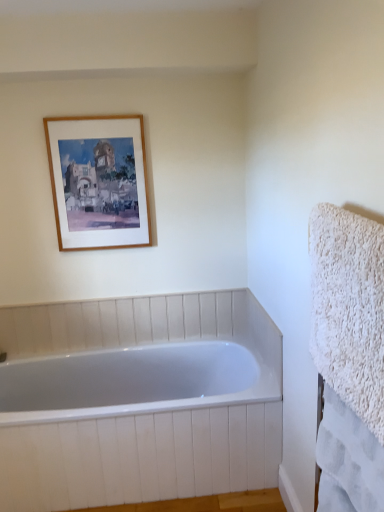
Describe the element at coordinates (142, 409) in the screenshot. I see `white glossy bathtub at center` at that location.

I want to click on white fluffy towel at right, placed as the first bath towel when sorted from top to bottom, so click(x=349, y=309).

What are the coordinates of `wooden frame at upper left` in the screenshot? It's located at (98, 181).

Considering the sizes of wooden frame at upper left and white fluffy towel at right, the second bath towel when ordered from top to bottom, in the image, is wooden frame at upper left wider or thinner than white fluffy towel at right, the second bath towel when ordered from top to bottom,?

In the image, wooden frame at upper left appears to be more narrow than white fluffy towel at right, the second bath towel when ordered from top to bottom.

Is wooden frame at upper left bigger than white fluffy towel at right, marked as the 1th bath towel in a bottom-to-top arrangement?

Yes, wooden frame at upper left is bigger than white fluffy towel at right, marked as the 1th bath towel in a bottom-to-top arrangement.

How many degrees apart are the facing directions of wooden frame at upper left and white fluffy towel at right, marked as the 1th bath towel in a bottom-to-top arrangement?

The angular difference between wooden frame at upper left and white fluffy towel at right, marked as the 1th bath towel in a bottom-to-top arrangement, is 90.6 degrees.

Does wooden frame at upper left lie in front of white fluffy towel at right, the second bath towel when ordered from top to bottom?

No, wooden frame at upper left is behind white fluffy towel at right, the second bath towel when ordered from top to bottom.

Is white fluffy towel at right, the second bath towel positioned from the bottom, to the left of white fluffy towel at right, marked as the 1th bath towel in a bottom-to-top arrangement, from the viewer's perspective?

Indeed, white fluffy towel at right, the second bath towel positioned from the bottom, is positioned on the left side of white fluffy towel at right, marked as the 1th bath towel in a bottom-to-top arrangement.

In terms of size, does white fluffy towel at right, the second bath towel positioned from the bottom, appear bigger or smaller than white fluffy towel at right, the second bath towel when ordered from top to bottom?

In the image, white fluffy towel at right, the second bath towel positioned from the bottom, appears to be larger than white fluffy towel at right, the second bath towel when ordered from top to bottom.

From the image's perspective, is white fluffy towel at right, placed as the first bath towel when sorted from top to bottom, above or below white fluffy towel at right, the second bath towel when ordered from top to bottom?

Clearly, from the image's perspective, white fluffy towel at right, placed as the first bath towel when sorted from top to bottom, is above white fluffy towel at right, the second bath towel when ordered from top to bottom.

From a real-world perspective, which is physically below, white fluffy towel at right, placed as the first bath towel when sorted from top to bottom, or white fluffy towel at right, the second bath towel when ordered from top to bottom?

white fluffy towel at right, the second bath towel when ordered from top to bottom, is physically lower.

Considering the sizes of objects white glossy bathtub at center and white fluffy towel at right, the second bath towel when ordered from top to bottom, in the image provided, who is wider, white glossy bathtub at center or white fluffy towel at right, the second bath towel when ordered from top to bottom,?

With larger width is white glossy bathtub at center.

Is white glossy bathtub at center looking in the opposite direction of white fluffy towel at right, marked as the 1th bath towel in a bottom-to-top arrangement?

That's not correct — white glossy bathtub at center is not looking away from white fluffy towel at right, marked as the 1th bath towel in a bottom-to-top arrangement.

From a real-world perspective, which object stands above the other?

white fluffy towel at right, marked as the 1th bath towel in a bottom-to-top arrangement, is physically above.

Considering the relative positions of white glossy bathtub at center and white fluffy towel at right, the second bath towel when ordered from top to bottom, in the image provided, is white glossy bathtub at center in front of white fluffy towel at right, the second bath towel when ordered from top to bottom,?

No.

Is white glossy bathtub at center at the back of wooden frame at upper left?

That's not correct — wooden frame at upper left is not looking away from white glossy bathtub at center.

Is the surface of wooden frame at upper left in direct contact with white glossy bathtub at center?

There is a gap between wooden frame at upper left and white glossy bathtub at center.

Identify the location of the 2nd bath towel in front of the wooden frame at upper left, starting your count from the anchor. [349, 309].

How different are the orientations of wooden frame at upper left and white fluffy towel at right, the second bath towel positioned from the bottom, in degrees?

There is a 90.6-degree angle between the facing directions of wooden frame at upper left and white fluffy towel at right, the second bath towel positioned from the bottom.

Consider the image. From a real-world perspective, is wooden frame at upper left positioned above or below white fluffy towel at right, placed as the first bath towel when sorted from top to bottom?

From a real-world perspective, wooden frame at upper left is physically above white fluffy towel at right, placed as the first bath towel when sorted from top to bottom.

Which is less distant, (75, 211) or (315, 338)?

The point (315, 338) is in front.

Who is bigger, white glossy bathtub at center or white fluffy towel at right, placed as the first bath towel when sorted from top to bottom?

white glossy bathtub at center.

Does point (155, 425) appear closer or farther from the camera than point (372, 356)?

Point (155, 425) is positioned farther from the camera compared to point (372, 356).

From a real-world perspective, between white glossy bathtub at center and white fluffy towel at right, placed as the first bath towel when sorted from top to bottom, who is vertically lower?

white glossy bathtub at center is physically lower.

Is white glossy bathtub at center inside or outside of white fluffy towel at right, placed as the first bath towel when sorted from top to bottom?

white glossy bathtub at center is not enclosed by white fluffy towel at right, placed as the first bath towel when sorted from top to bottom.

In terms of size, does white fluffy towel at right, placed as the first bath towel when sorted from top to bottom, appear bigger or smaller than wooden frame at upper left?

Clearly, white fluffy towel at right, placed as the first bath towel when sorted from top to bottom, is larger in size than wooden frame at upper left.

Is white fluffy towel at right, the second bath towel positioned from the bottom, oriented towards wooden frame at upper left?

No.

Is white fluffy towel at right, the second bath towel positioned from the bottom, wider than wooden frame at upper left?

Yes, white fluffy towel at right, the second bath towel positioned from the bottom, is wider than wooden frame at upper left.

Consider the image. How many degrees apart are the facing directions of white fluffy towel at right, the second bath towel positioned from the bottom, and wooden frame at upper left?

90.6 degrees.

Locate an element on the screen. This screenshot has height=512, width=384. bath towel that is the 2nd object located below the wooden frame at upper left (from the image's perspective) is located at coordinates tap(348, 460).

You are a GUI agent. You are given a task and a screenshot of the screen. Output one action in this format:
    pyautogui.click(x=<x>, y=<y>)
    Task: Click on the bath towel on the left of white fluffy towel at right, marked as the 1th bath towel in a bottom-to-top arrangement
    
    Given the screenshot: What is the action you would take?
    pos(349,309)

Which object lies nearer to the anchor point white fluffy towel at right, marked as the 1th bath towel in a bottom-to-top arrangement, white glossy bathtub at center or white fluffy towel at right, placed as the first bath towel when sorted from top to bottom?

white fluffy towel at right, placed as the first bath towel when sorted from top to bottom, is closer to white fluffy towel at right, marked as the 1th bath towel in a bottom-to-top arrangement.

Estimate the real-world distances between objects in this image. Which object is further from white fluffy towel at right, the second bath towel positioned from the bottom, white fluffy towel at right, the second bath towel when ordered from top to bottom, or wooden frame at upper left?

Among the two, wooden frame at upper left is located further to white fluffy towel at right, the second bath towel positioned from the bottom.

Based on their spatial positions, is white fluffy towel at right, placed as the first bath towel when sorted from top to bottom, or wooden frame at upper left closer to white glossy bathtub at center?

wooden frame at upper left lies closer to white glossy bathtub at center than the other object.

Looking at this image, based on their spatial positions, is white glossy bathtub at center or white fluffy towel at right, the second bath towel when ordered from top to bottom, further from white fluffy towel at right, the second bath towel positioned from the bottom?

white glossy bathtub at center.

Considering their positions, is white fluffy towel at right, marked as the 1th bath towel in a bottom-to-top arrangement, positioned further to wooden frame at upper left than white fluffy towel at right, the second bath towel positioned from the bottom?

Among the two, white fluffy towel at right, marked as the 1th bath towel in a bottom-to-top arrangement, is located further to wooden frame at upper left.

Based on their spatial positions, is white fluffy towel at right, marked as the 1th bath towel in a bottom-to-top arrangement, or white glossy bathtub at center closer to wooden frame at upper left?

Based on the image, white glossy bathtub at center appears to be nearer to wooden frame at upper left.

Which object lies further to the anchor point white fluffy towel at right, marked as the 1th bath towel in a bottom-to-top arrangement, white fluffy towel at right, the second bath towel positioned from the bottom, or white glossy bathtub at center?

Based on the image, white glossy bathtub at center appears to be further to white fluffy towel at right, marked as the 1th bath towel in a bottom-to-top arrangement.

Which object lies nearer to the anchor point white fluffy towel at right, the second bath towel positioned from the bottom, wooden frame at upper left or white fluffy towel at right, marked as the 1th bath towel in a bottom-to-top arrangement?

white fluffy towel at right, marked as the 1th bath towel in a bottom-to-top arrangement.

Find the location of `bath towel between white fluffy towel at right, placed as the first bath towel when sorted from top to bottom, and white glossy bathtub at center, along the z-axis`. bath towel between white fluffy towel at right, placed as the first bath towel when sorted from top to bottom, and white glossy bathtub at center, along the z-axis is located at coordinates (348, 460).

The image size is (384, 512). In order to click on bath towel between white fluffy towel at right, placed as the first bath towel when sorted from top to bottom, and wooden frame at upper left in the front-back direction in this screenshot , I will do `click(348, 460)`.

In order to click on bathtub positioned between white fluffy towel at right, the second bath towel when ordered from top to bottom, and wooden frame at upper left from near to far in this screenshot , I will do `click(142, 409)`.

This screenshot has height=512, width=384. In order to click on bathtub between white fluffy towel at right, the second bath towel positioned from the bottom, and wooden frame at upper left from front to back in this screenshot , I will do `click(142, 409)`.